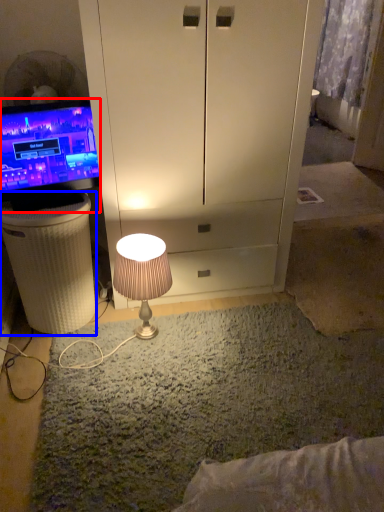
Question: Which point is closer to the camera, television (highlighted by a red box) or vanity (highlighted by a blue box)?

Choices:
 (A) television
 (B) vanity

Answer: (A)